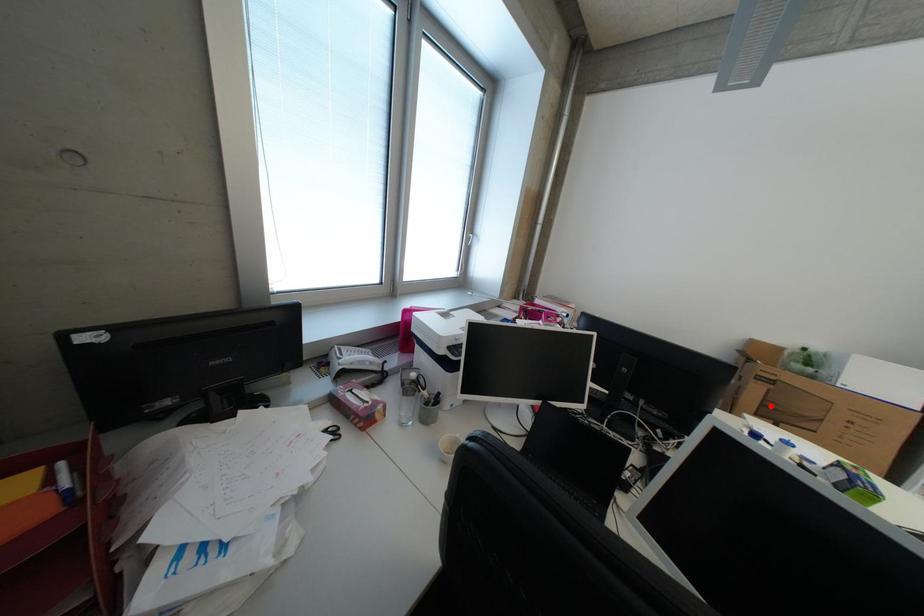
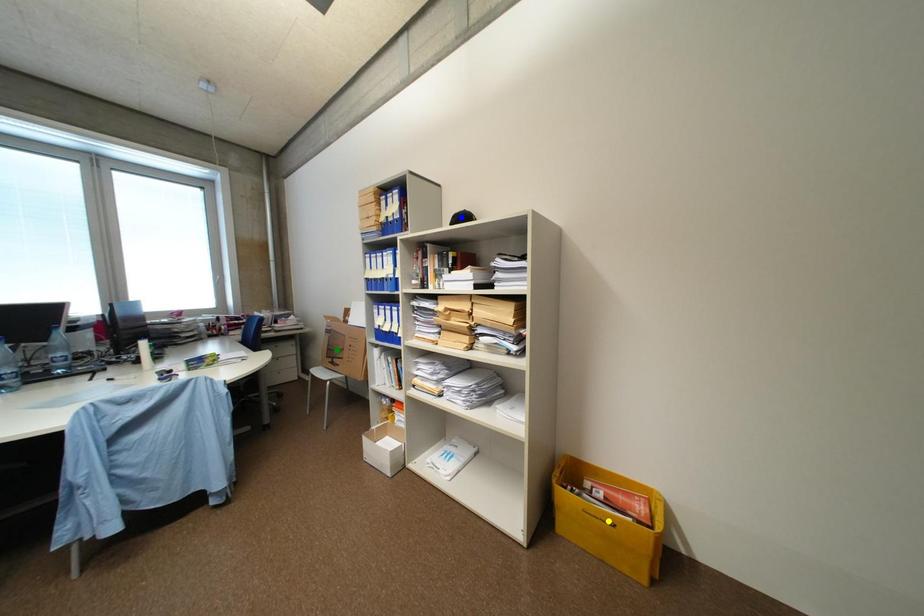
Question: I am providing you with two images of the same scene from different viewpoints. A red point is marked on the first image. You are given multiple points on the second image. In image 2, which mark is for the same physical point as the one in image 1?

Choices:
 (A) green point
 (B) blue point
 (C) yellow point

Answer: (A)